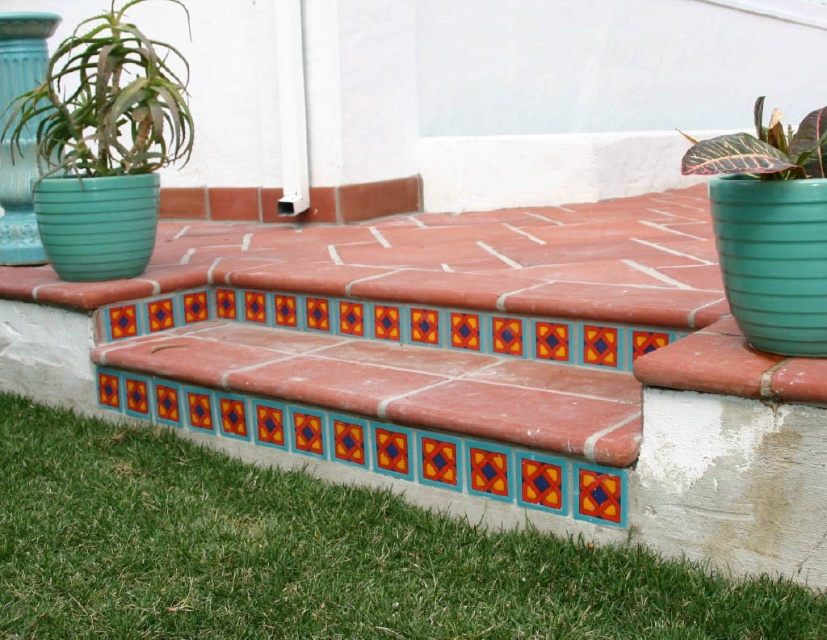
Which is below, green matte pot at upper left or multicolored tile at center?

multicolored tile at center is lower down.

Between green matte pot at upper left and multicolored tile at center, which one appears on the right side from the viewer's perspective?

multicolored tile at center

This screenshot has width=827, height=640. I want to click on green matte pot at upper left, so click(106, 102).

Identify the location of green matte pot at upper left. (106, 102).

Between terracotta tile bench at center and leathery green leaf at right, which one appears on the right side from the viewer's perspective?

Positioned to the right is leathery green leaf at right.

Is terracotta tile bench at center closer to the viewer compared to leathery green leaf at right?

That is False.

Does point (598, 234) lie in front of point (765, 125)?

No, it is behind (765, 125).

You are a GUI agent. You are given a task and a screenshot of the screen. Output one action in this format:
    pyautogui.click(x=<x>, y=<y>)
    Task: Click on the terracotta tile bench at center
    The height and width of the screenshot is (640, 827).
    Given the screenshot: What is the action you would take?
    pyautogui.click(x=467, y=364)

Is point (189, 508) closer to camera compared to point (814, 154)?

No, (189, 508) is behind (814, 154).

Is point (174, 548) less distant than point (818, 161)?

No.

At what (x,y) coordinates should I click in order to perform the action: click on green grass at lower left. Please return your answer as a coordinate pair (x, y). Image resolution: width=827 pixels, height=640 pixels. Looking at the image, I should click on (312, 556).